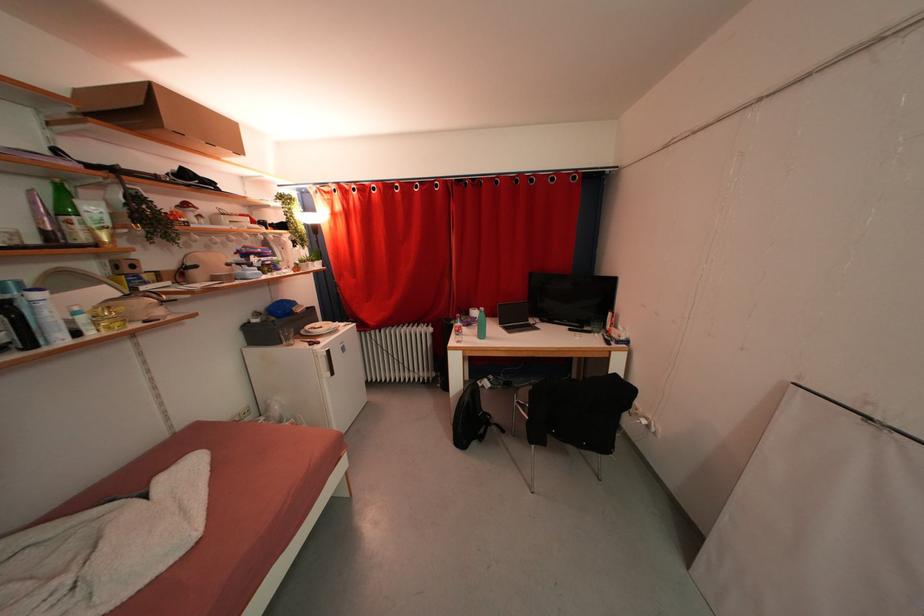
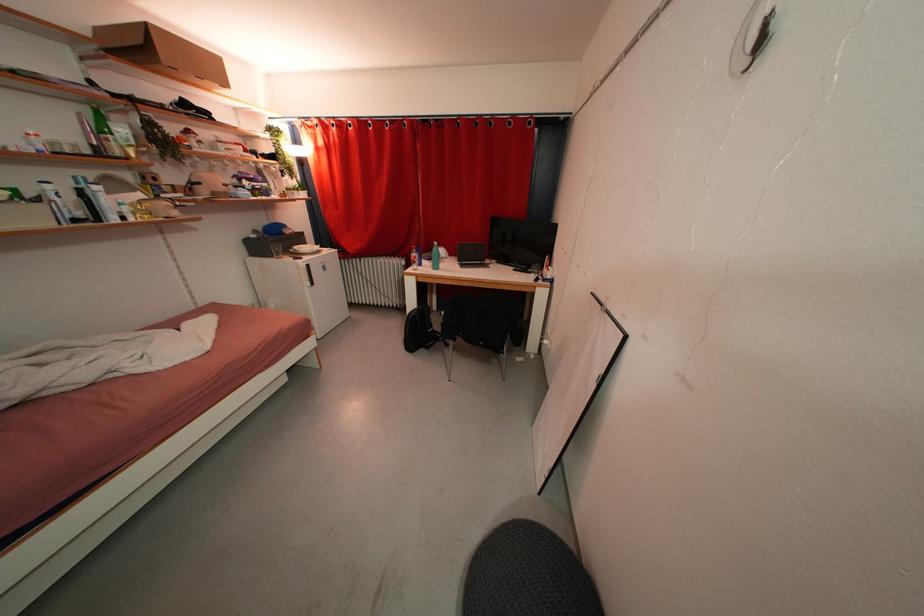
The point at (x=472, y=403) is marked in the first image. Where is the corresponding point in the second image?

(419, 317)